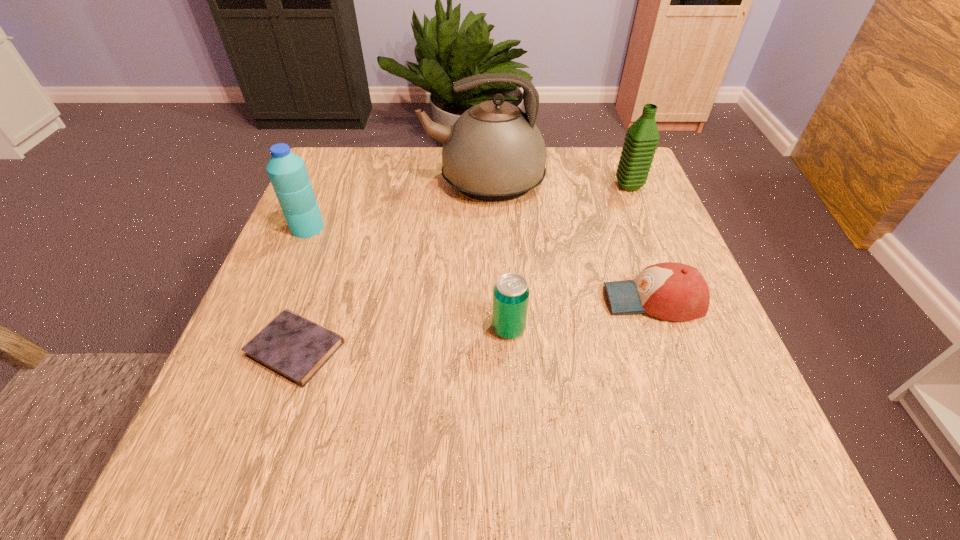
The image size is (960, 540). Identify the location of free space located 0.160m on the back of the right water bottle. (612, 146).

Find the location of a particular element. This screenshot has width=960, height=540. vacant area located 0.160m on the front of the third farthest object is located at coordinates (279, 294).

The width and height of the screenshot is (960, 540). Find the location of `blank space located on the back of the third shortest object`. blank space located on the back of the third shortest object is located at coordinates (502, 213).

At what (x,y) coordinates should I click in order to perform the action: click on free spot located 0.320m on the front-facing side of the second shortest object. Please return your answer as a coordinate pair (x, y). Looking at the image, I should click on (434, 300).

This screenshot has height=540, width=960. I want to click on vacant space situated 0.370m on the front-facing side of the second shortest object, so click(x=407, y=300).

You are a GUI agent. You are given a task and a screenshot of the screen. Output one action in this format:
    pyautogui.click(x=<x>, y=<y>)
    Task: Click on the vacant region located 0.160m on the front-facing side of the second shortest object
    The image size is (960, 540).
    Given the screenshot: What is the action you would take?
    pyautogui.click(x=519, y=300)

Locate an element on the screen. This screenshot has height=540, width=960. free space located 0.160m on the front of the shortest object is located at coordinates (245, 496).

Locate an element on the screen. The height and width of the screenshot is (540, 960). kettle that is at the far edge is located at coordinates (494, 152).

Locate an element on the screen. The image size is (960, 540). water bottle at the far edge is located at coordinates (642, 137).

What are the coordinates of `water bottle that is at the left edge` in the screenshot? It's located at (288, 174).